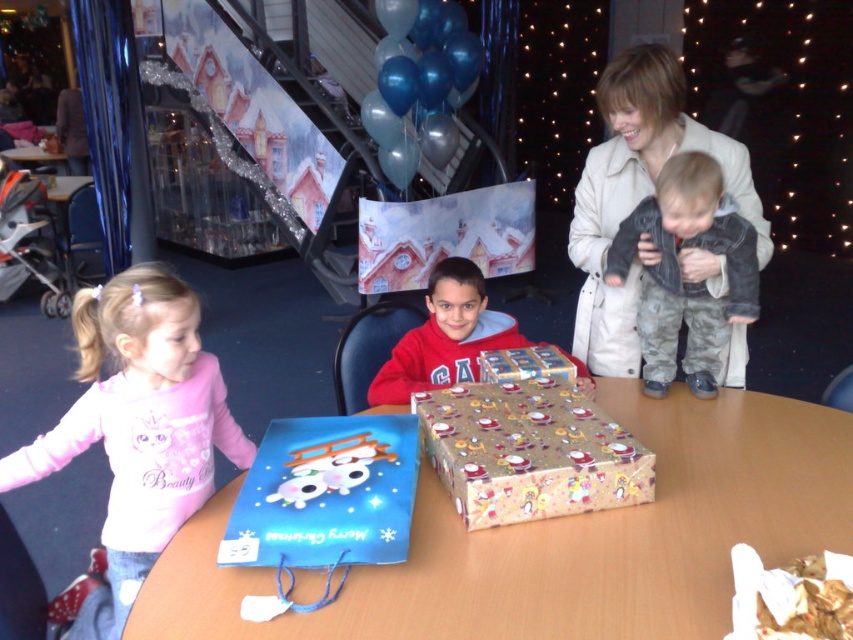
Question: Does wooden table at center appear on the right side of red matte sweater at center?

Choices:
 (A) yes
 (B) no

Answer: (A)

Question: Is wooden table at center to the left of pink fleece shirt at lower left from the viewer's perspective?

Choices:
 (A) yes
 (B) no

Answer: (B)

Question: Estimate the real-world distances between objects in this image. Which object is closer to the gold shiny wrapping paper at center?

Choices:
 (A) camouflage pants at center
 (B) wooden table at center
 (C) pink fleece shirt at lower left
 (D) red matte sweater at center

Answer: (D)

Question: Which object is closer to the camera taking this photo?

Choices:
 (A) gold shiny wrapping paper at center
 (B) camouflage pants at center
 (C) red matte sweater at center
 (D) pink fleece shirt at lower left

Answer: (D)

Question: Which object is farther from the camera taking this photo?

Choices:
 (A) pink fleece shirt at lower left
 (B) red matte sweater at center
 (C) gold shiny wrapping paper at center

Answer: (B)

Question: Does red matte sweater at center appear on the right side of gold shiny wrapping paper at center?

Choices:
 (A) no
 (B) yes

Answer: (A)